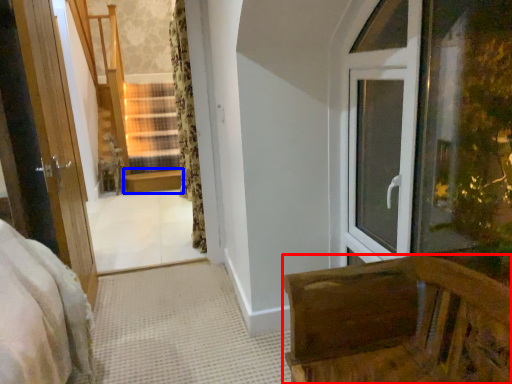
Question: Among these objects, which one is nearest to the camera, furniture (highlighted by a red box) or window sill (highlighted by a blue box)?

Choices:
 (A) furniture
 (B) window sill

Answer: (A)